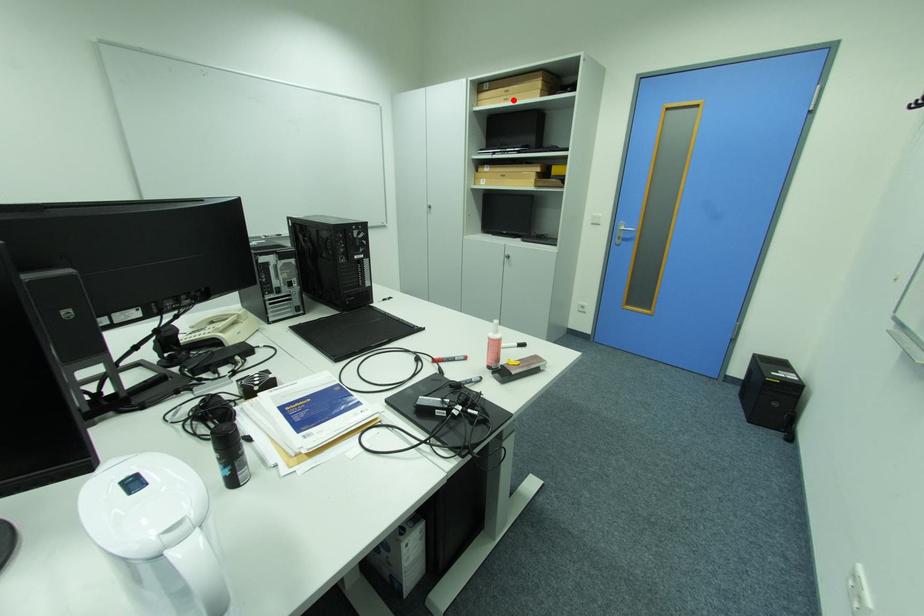
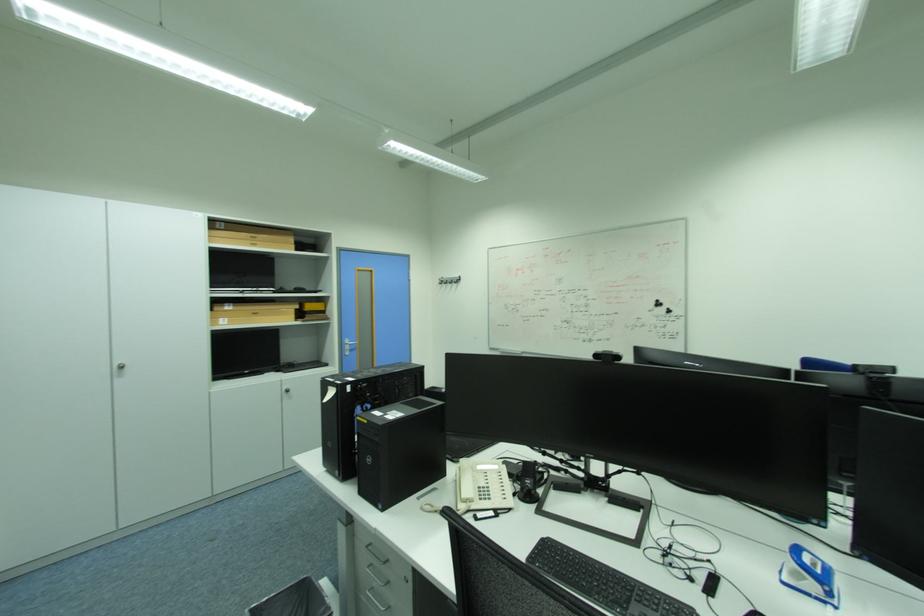
Locate, in the second image, the point that corresponds to the highlighted location in the first image.

(261, 246)